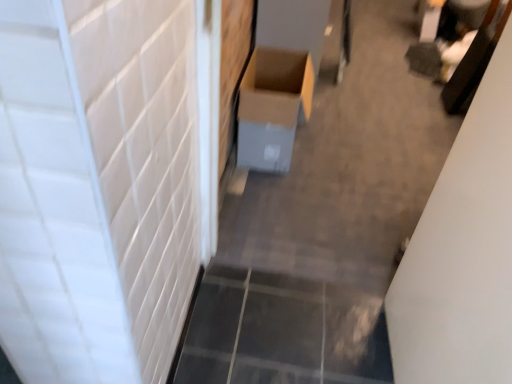
What do you see at coordinates (273, 107) in the screenshot?
I see `cardboard box at center` at bounding box center [273, 107].

I want to click on cardboard box at center, so click(273, 107).

At what (x,y) coordinates should I click in order to perform the action: click on cardboard box at center. Please return your answer as a coordinate pair (x, y). Image resolution: width=512 pixels, height=384 pixels. Looking at the image, I should click on (273, 107).